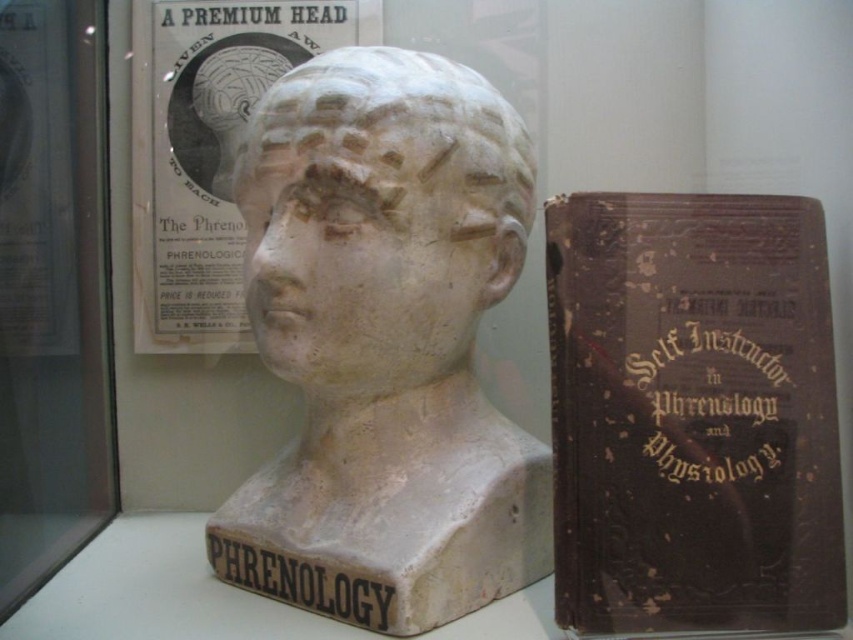
Question: Does brown leather book at right appear under white plaster head at center?

Choices:
 (A) yes
 (B) no

Answer: (A)

Question: Is brown leather book at right to the left of white plaster head at center from the viewer's perspective?

Choices:
 (A) yes
 (B) no

Answer: (B)

Question: Is brown leather book at right to the left of white plaster head at center from the viewer's perspective?

Choices:
 (A) yes
 (B) no

Answer: (B)

Question: Which point is farther to the camera?

Choices:
 (A) (358, 138)
 (B) (728, 305)

Answer: (A)

Question: Which point is farther from the camera taking this photo?

Choices:
 (A) (451, 260)
 (B) (700, 257)

Answer: (A)

Question: Which point appears farthest from the camera in this image?

Choices:
 (A) (339, 324)
 (B) (784, 554)

Answer: (A)